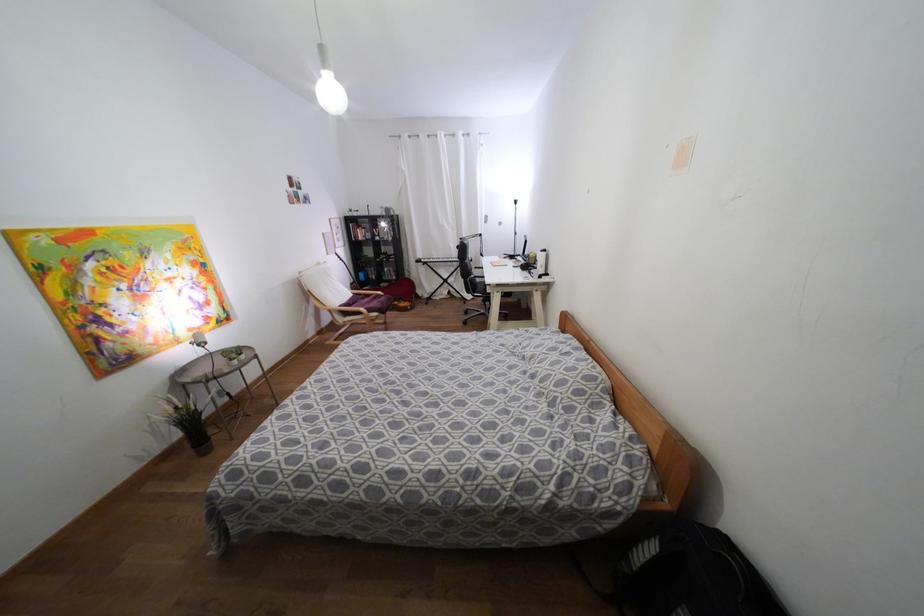
At what (x,y) coordinates should I click in order to perform the action: click on small table lamp. Please return your answer as a coordinate pair (x, y). This screenshot has height=616, width=924. Looking at the image, I should click on (198, 339).